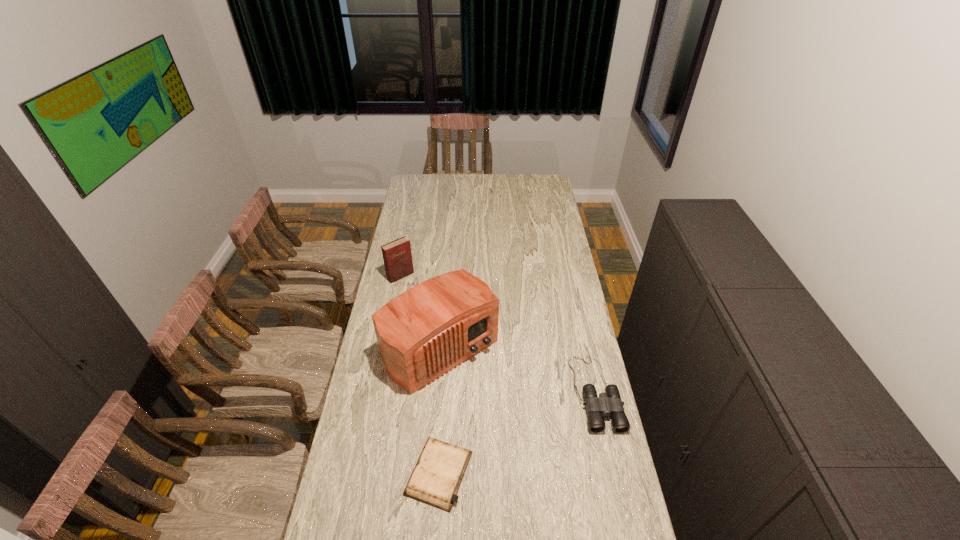
The width and height of the screenshot is (960, 540). Identify the location of the nearest object. (435, 480).

You are a GUI agent. You are given a task and a screenshot of the screen. Output one action in this format:
    pyautogui.click(x=<x>, y=<y>)
    Task: Click on the shorter diary
    This screenshot has height=540, width=960.
    Given the screenshot: What is the action you would take?
    pyautogui.click(x=435, y=480)

The image size is (960, 540). What are the coordinates of `the rightmost object` in the screenshot? It's located at (609, 403).

This screenshot has width=960, height=540. In order to click on binoculars in this screenshot , I will do `click(609, 403)`.

This screenshot has height=540, width=960. I want to click on the tallest object, so click(x=431, y=328).

Identify the location of the farther diary. The width and height of the screenshot is (960, 540). (397, 256).

This screenshot has width=960, height=540. Find the location of `the farthest object`. the farthest object is located at coordinates (397, 256).

This screenshot has width=960, height=540. In order to click on vacant space located on the back of the shorter diary in this screenshot , I will do `click(446, 362)`.

Find the location of a particular element. Image resolution: width=960 pixels, height=540 pixels. vacant space located at the eyepiece of the binoculars is located at coordinates (612, 466).

Locate an element on the screen. This screenshot has width=960, height=540. vacant space situated on the front-facing side of the tallest object is located at coordinates pyautogui.click(x=552, y=467).